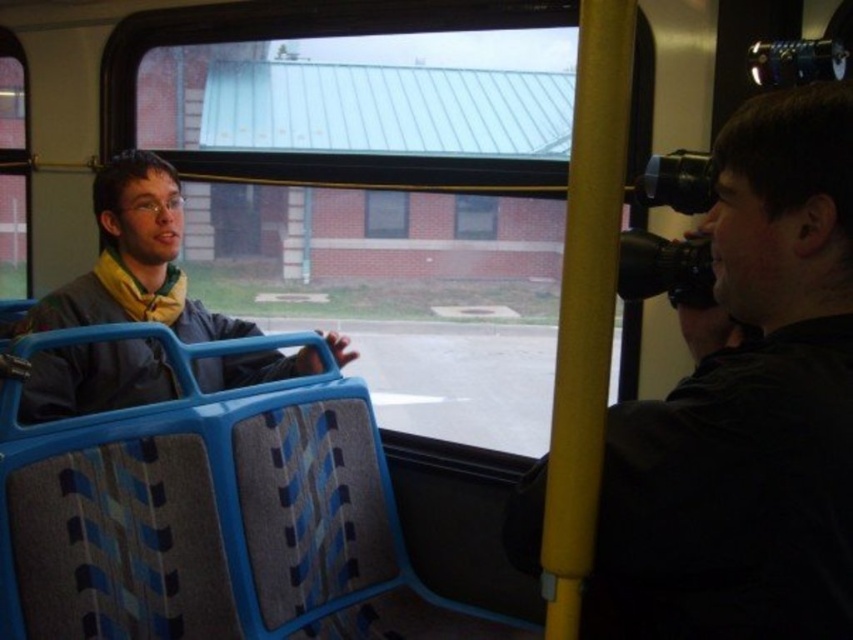
Is black rubber camera at right wider than matte gray jacket at left?

No, black rubber camera at right is not wider than matte gray jacket at left.

Can you confirm if black rubber camera at right is positioned to the right of matte gray jacket at left?

Correct, you'll find black rubber camera at right to the right of matte gray jacket at left.

Does point (788, 612) lie in front of point (32, 394)?

Yes, point (788, 612) is closer to viewer.

In order to click on black rubber camera at right in this screenshot , I will do `click(746, 406)`.